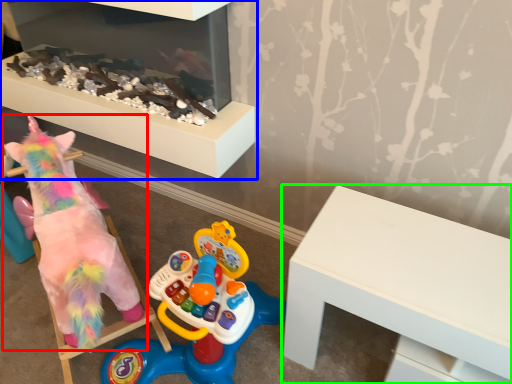
Question: Considering the real-world distances, which object is farthest from toy (highlighted by a red box)? furniture (highlighted by a blue box) or table (highlighted by a green box)?

Choices:
 (A) furniture
 (B) table

Answer: (B)